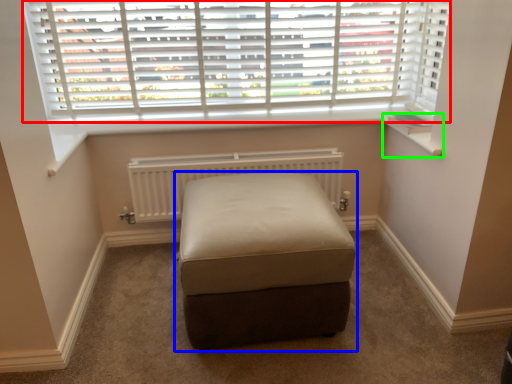
Question: Which object is the closest to the window (highlighted by a red box)? Choose among these: furniture (highlighted by a blue box) or window sill (highlighted by a green box).

Choices:
 (A) furniture
 (B) window sill

Answer: (B)